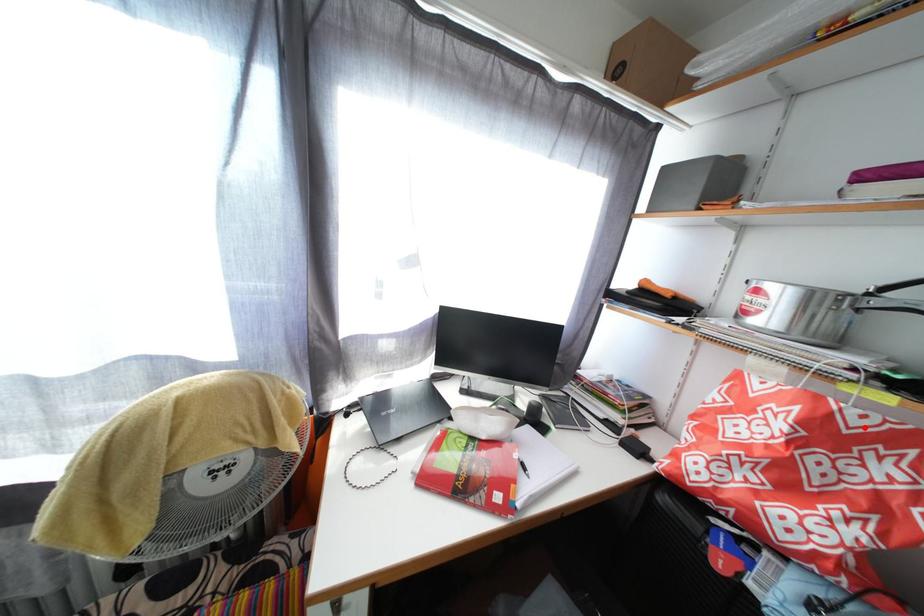
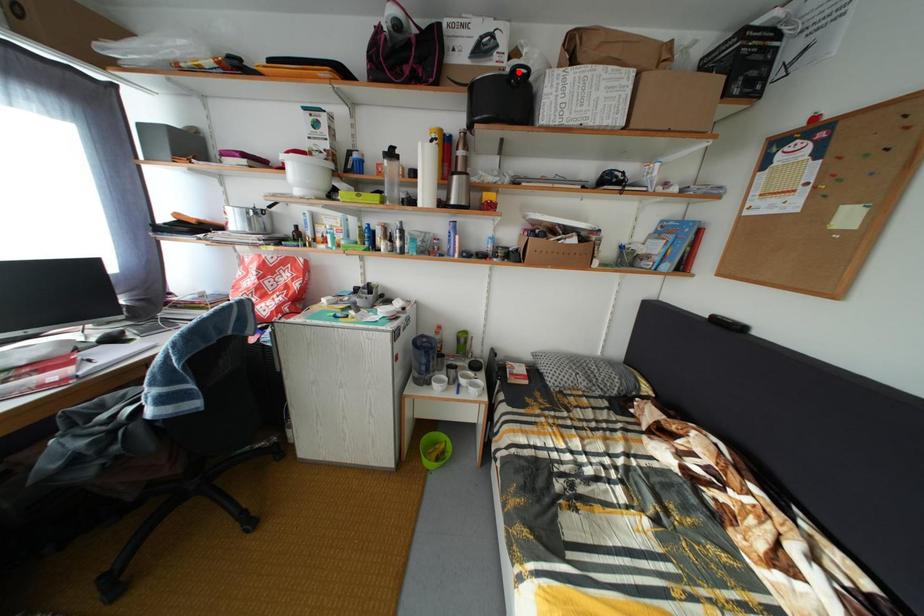
I am providing you with two images of the same scene from different viewpoints. A red point is marked on the first image and another point is marked on the second image. Is the red point in image1 aligned with the point shown in image2?

No